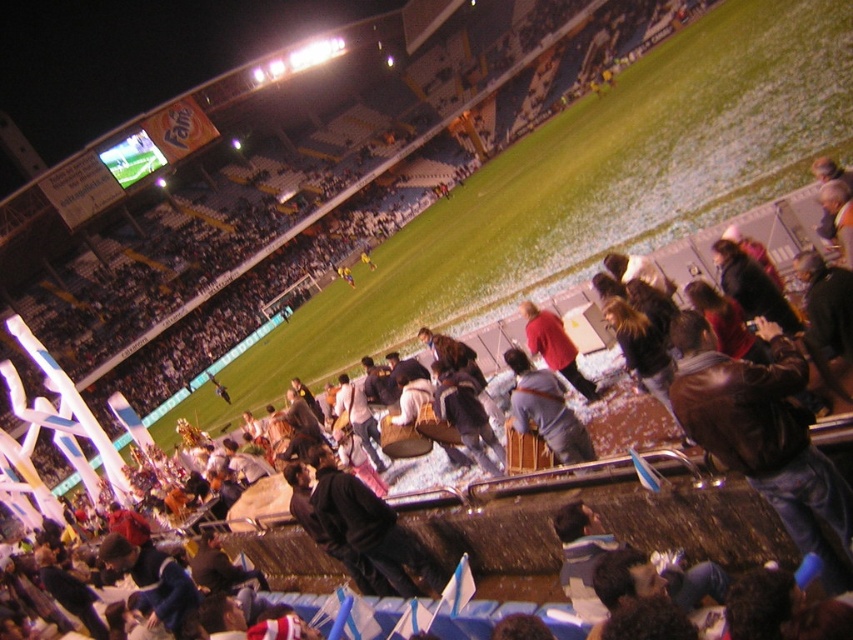
You are a photographer at the stadium and want to capture both the gray fabric jacket at center and the red matte jacket at center in a single photo. However, you can only focus on one jacket at a time. Which jacket should you focus on to ensure the other is still visible in the background?

You should focus on the gray fabric jacket at center because it is in front of the red matte jacket at center, so the red matte jacket at center will naturally appear in the background.

You are a photographer at the sports stadium and want to capture the gray fabric jacket at center. What are the coordinates where you should focus your camera?

The gray fabric jacket at center is located at coordinates point (x=546, y=410).